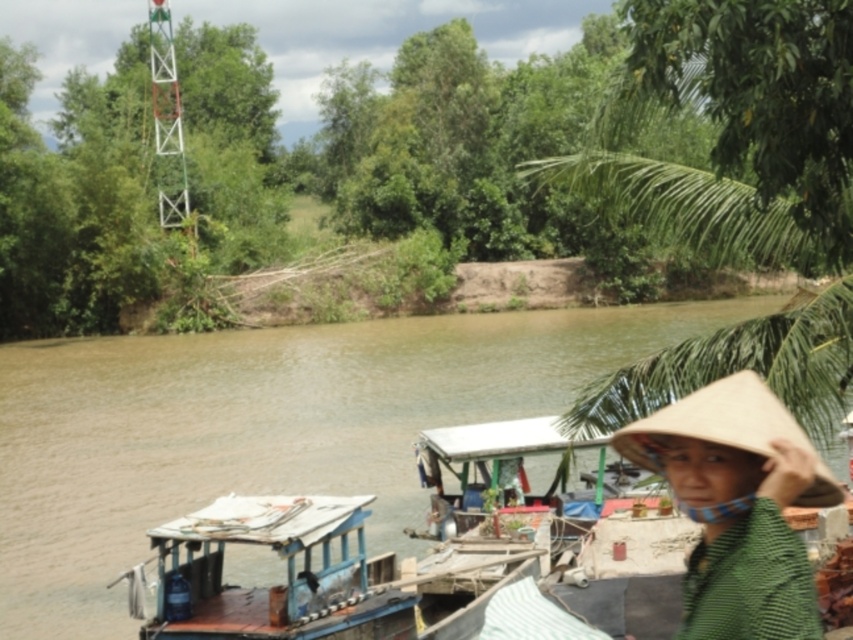
You are standing on the riverside and want to pick up the bleached straw hat at lower right. Is the brown muddy water at center in your way?

The brown muddy water at center is located above the bleached straw hat at lower right, so yes, the water is in your way when reaching for the hat.

Based on the photo, you are standing at the point marked by the coordinates point (264,586) in the image. Which object are you currently on?

You are on the wooden boat at center.